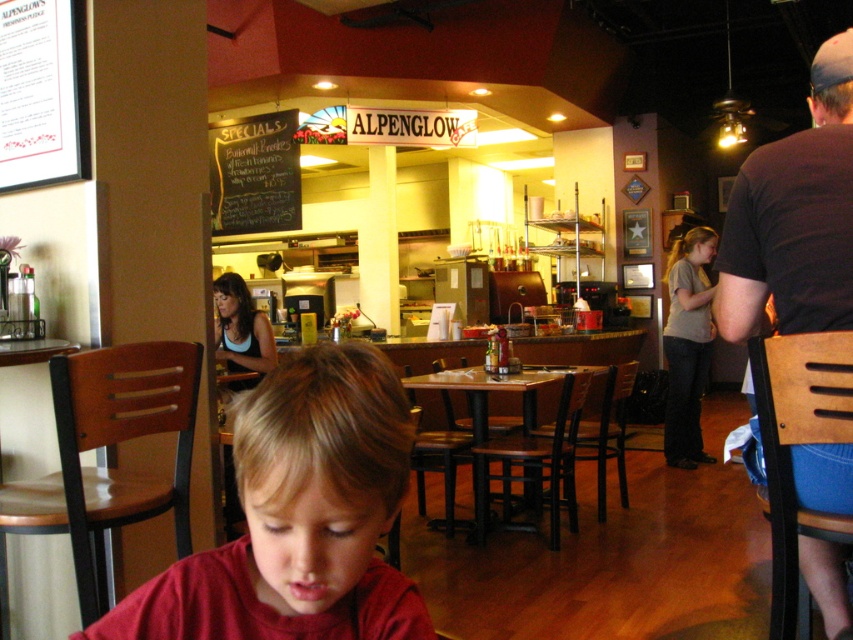
Question: Can you confirm if black chalkboard specials at upper center is positioned above brown wood table at center?

Choices:
 (A) no
 (B) yes

Answer: (B)

Question: Is matte red shirt at center wider than gray cotton shirt at right?

Choices:
 (A) no
 (B) yes

Answer: (A)

Question: Estimate the real-world distances between objects in this image. Which object is farther from the black chalkboard specials at upper center?

Choices:
 (A) brown wood table at center
 (B) gray cotton shirt at right
 (C) dark brown leather chair at right
 (D) matte red shirt at center

Answer: (D)

Question: Which object is positioned closest to the gray cotton shirt at right?

Choices:
 (A) matte red shirt at center
 (B) brown wood table at center
 (C) dark brown leather chair at right

Answer: (B)

Question: Which is nearer to the black chalkboard specials at upper center?

Choices:
 (A) dark brown leather chair at right
 (B) brown wood table at center
 (C) matte red shirt at center
 (D) gray cotton shirt at right

Answer: (B)

Question: Is black chalkboard specials at upper center to the left of gray cotton shirt at right from the viewer's perspective?

Choices:
 (A) yes
 (B) no

Answer: (A)